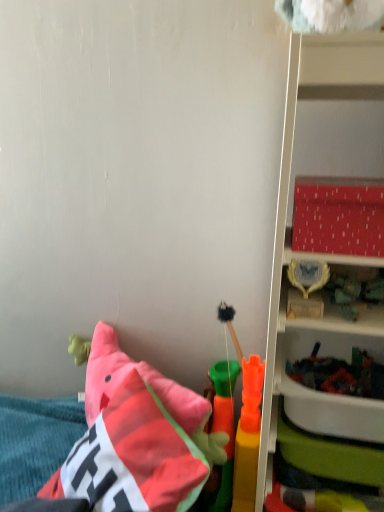
What are the coordinates of `matte red plastic shelf at right` in the screenshot? It's located at (291, 160).

What do you see at coordinates (224, 428) in the screenshot? I see `rubber carrot at center, which ranks as the second toy in back-to-front order` at bounding box center [224, 428].

This screenshot has height=512, width=384. I want to click on matte red plastic shelf at right, so click(x=291, y=160).

Measure the distance from soft plush pillow at lower left to rubber carrot at center, which ranks as the second toy in back-to-front order.

soft plush pillow at lower left is 8.83 inches from rubber carrot at center, which ranks as the second toy in back-to-front order.

Which point is more distant from viewer, (129,402) or (228,450)?

The point (228,450) is more distant.

From a real-world perspective, is soft plush pillow at lower left over rubber carrot at center, acting as the second toy starting from the front?

Yes, from a real-world perspective, soft plush pillow at lower left is on top of rubber carrot at center, acting as the second toy starting from the front.

Would you say soft plush pillow at lower left is outside rubber carrot at center, which ranks as the second toy in back-to-front order?

Yes, soft plush pillow at lower left is located beyond the bounds of rubber carrot at center, which ranks as the second toy in back-to-front order.

Visually, is matte red plastic shelf at right positioned to the left or to the right of soft fuzzy brush at center, which ranks as the first toy in back-to-front order?

matte red plastic shelf at right is to the right of soft fuzzy brush at center, which ranks as the first toy in back-to-front order.

From a real-world perspective, is matte red plastic shelf at right physically located above or below soft fuzzy brush at center, the 3th toy from the front?

matte red plastic shelf at right is situated higher than soft fuzzy brush at center, the 3th toy from the front, in the real world.

From a real-world perspective, which toy is the 1st one underneath the matte red plastic shelf at right? Please provide its 2D coordinates.

[(229, 325)]

Between matte red plastic shelf at right and soft fuzzy brush at center, the 3th toy from the front, which one has larger size?

matte red plastic shelf at right is bigger.

You are a GUI agent. You are given a task and a screenshot of the screen. Output one action in this format:
    pyautogui.click(x=<x>, y=<y>)
    Task: Click on the pillow that is in front of the soft fuzzy brush at center, the 3th toy from the front
    
    Given the screenshot: What is the action you would take?
    pyautogui.click(x=137, y=437)

Is soft plush pillow at lower left in front of or behind soft fuzzy brush at center, which ranks as the first toy in back-to-front order, in the image?

Answer: Clearly, soft plush pillow at lower left is in front of soft fuzzy brush at center, which ranks as the first toy in back-to-front order.

How different are the orientations of soft plush pillow at lower left and soft fuzzy brush at center, which ranks as the first toy in back-to-front order, in degrees?

53.1 degrees.

Starting from the soft fuzzy brush at center, the 3th toy from the front, which toy is the 2nd one in front? Please provide its 2D coordinates.

[(248, 436)]

Which of these two, soft fuzzy brush at center, which ranks as the first toy in back-to-front order, or smooth plastic toy at lower right, which ranks as the first toy in front-to-back order, is thinner?

With smaller width is soft fuzzy brush at center, which ranks as the first toy in back-to-front order.

From the image's perspective, would you say soft fuzzy brush at center, which ranks as the first toy in back-to-front order, is shown under smooth plastic toy at lower right, which ranks as the first toy in front-to-back order?

Incorrect, from the image's perspective, soft fuzzy brush at center, which ranks as the first toy in back-to-front order, is higher than smooth plastic toy at lower right, which ranks as the first toy in front-to-back order.

Looking at this image, from a real-world perspective, is soft fuzzy brush at center, the 3th toy from the front, positioned over smooth plastic toy at lower right, placed as the 3th toy when sorted from back to front, based on gravity?

Correct, in the physical world, soft fuzzy brush at center, the 3th toy from the front, is higher than smooth plastic toy at lower right, placed as the 3th toy when sorted from back to front.

Consider the image. Which is closer to the camera, (350, 70) or (254, 468)?

The point (350, 70) is closer to the camera.

Can we say matte red plastic shelf at right lies outside smooth plastic toy at lower right, which ranks as the first toy in front-to-back order?

Yes, matte red plastic shelf at right is located beyond the bounds of smooth plastic toy at lower right, which ranks as the first toy in front-to-back order.

The width and height of the screenshot is (384, 512). I want to click on the 1st toy to the left of the matte red plastic shelf at right, starting your count from the anchor, so click(x=248, y=436).

Is matte red plastic shelf at right placed right next to smooth plastic toy at lower right, placed as the 3th toy when sorted from back to front?

No, matte red plastic shelf at right is not making contact with smooth plastic toy at lower right, placed as the 3th toy when sorted from back to front.

Would you say smooth plastic toy at lower right, which ranks as the first toy in front-to-back order, is inside or outside soft fuzzy brush at center, which ranks as the first toy in back-to-front order?

smooth plastic toy at lower right, which ranks as the first toy in front-to-back order, lies outside soft fuzzy brush at center, which ranks as the first toy in back-to-front order.

How distant is smooth plastic toy at lower right, placed as the 3th toy when sorted from back to front, from soft fuzzy brush at center, the 3th toy from the front?

smooth plastic toy at lower right, placed as the 3th toy when sorted from back to front, and soft fuzzy brush at center, the 3th toy from the front, are 6.77 inches apart.

Which of these two, smooth plastic toy at lower right, placed as the 3th toy when sorted from back to front, or soft fuzzy brush at center, the 3th toy from the front, is bigger?

smooth plastic toy at lower right, placed as the 3th toy when sorted from back to front.

You are a GUI agent. You are given a task and a screenshot of the screen. Output one action in this format:
    pyautogui.click(x=<x>, y=<y>)
    Task: Click on the 3rd toy behind when counting from the matte red plastic shelf at right
    
    Given the screenshot: What is the action you would take?
    pyautogui.click(x=229, y=325)

Considering the relative sizes of soft fuzzy brush at center, which ranks as the first toy in back-to-front order, and matte red plastic shelf at right in the image provided, is soft fuzzy brush at center, which ranks as the first toy in back-to-front order, bigger than matte red plastic shelf at right?

No.

Is soft fuzzy brush at center, the 3th toy from the front, looking in the opposite direction of matte red plastic shelf at right?

No.

Which is more to the right, soft fuzzy brush at center, which ranks as the first toy in back-to-front order, or matte red plastic shelf at right?

matte red plastic shelf at right.

This screenshot has height=512, width=384. Identify the location of pillow in front of the rubber carrot at center, which ranks as the second toy in back-to-front order. (137, 437).

Where is `shelf above the soft fuzzy brush at center, the 3th toy from the front (from a real-world perspective)`? The width and height of the screenshot is (384, 512). shelf above the soft fuzzy brush at center, the 3th toy from the front (from a real-world perspective) is located at coordinates (291, 160).

Which object lies further to the anchor point smooth plastic toy at lower right, which ranks as the first toy in front-to-back order, soft fuzzy brush at center, the 3th toy from the front, or rubber carrot at center, acting as the second toy starting from the front?

soft fuzzy brush at center, the 3th toy from the front, is further to smooth plastic toy at lower right, which ranks as the first toy in front-to-back order.

Considering their positions, is rubber carrot at center, acting as the second toy starting from the front, positioned closer to soft fuzzy brush at center, the 3th toy from the front, than matte red plastic shelf at right?

rubber carrot at center, acting as the second toy starting from the front, is positioned closer to the anchor soft fuzzy brush at center, the 3th toy from the front.

Based on their spatial positions, is soft fuzzy brush at center, which ranks as the first toy in back-to-front order, or smooth plastic toy at lower right, which ranks as the first toy in front-to-back order, closer to rubber carrot at center, which ranks as the second toy in back-to-front order?

Among the two, smooth plastic toy at lower right, which ranks as the first toy in front-to-back order, is located nearer to rubber carrot at center, which ranks as the second toy in back-to-front order.

From the image, which object appears to be farther from matte red plastic shelf at right, soft fuzzy brush at center, which ranks as the first toy in back-to-front order, or rubber carrot at center, acting as the second toy starting from the front?

soft fuzzy brush at center, which ranks as the first toy in back-to-front order, is positioned further to the anchor matte red plastic shelf at right.

Which object lies nearer to the anchor point rubber carrot at center, which ranks as the second toy in back-to-front order, smooth plastic toy at lower right, which ranks as the first toy in front-to-back order, or soft plush pillow at lower left?

smooth plastic toy at lower right, which ranks as the first toy in front-to-back order, is closer to rubber carrot at center, which ranks as the second toy in back-to-front order.

Consider the image. Considering their positions, is rubber carrot at center, which ranks as the second toy in back-to-front order, positioned closer to soft fuzzy brush at center, which ranks as the first toy in back-to-front order, than smooth plastic toy at lower right, placed as the 3th toy when sorted from back to front?

rubber carrot at center, which ranks as the second toy in back-to-front order, lies closer to soft fuzzy brush at center, which ranks as the first toy in back-to-front order, than the other object.

Based on their spatial positions, is soft plush pillow at lower left or rubber carrot at center, acting as the second toy starting from the front, closer to matte red plastic shelf at right?

soft plush pillow at lower left lies closer to matte red plastic shelf at right than the other object.

Looking at the image, which one is located closer to rubber carrot at center, acting as the second toy starting from the front, matte red plastic shelf at right or soft fuzzy brush at center, which ranks as the first toy in back-to-front order?

soft fuzzy brush at center, which ranks as the first toy in back-to-front order, is positioned closer to the anchor rubber carrot at center, acting as the second toy starting from the front.

The width and height of the screenshot is (384, 512). Find the location of `toy located between soft plush pillow at lower left and rubber carrot at center, which ranks as the second toy in back-to-front order, in the depth direction`. toy located between soft plush pillow at lower left and rubber carrot at center, which ranks as the second toy in back-to-front order, in the depth direction is located at coordinates (248, 436).

Identify the location of toy located between matte red plastic shelf at right and rubber carrot at center, acting as the second toy starting from the front, in the depth direction. (248, 436).

Identify the location of toy between soft fuzzy brush at center, the 3th toy from the front, and rubber carrot at center, acting as the second toy starting from the front, from top to bottom. The height and width of the screenshot is (512, 384). (248, 436).